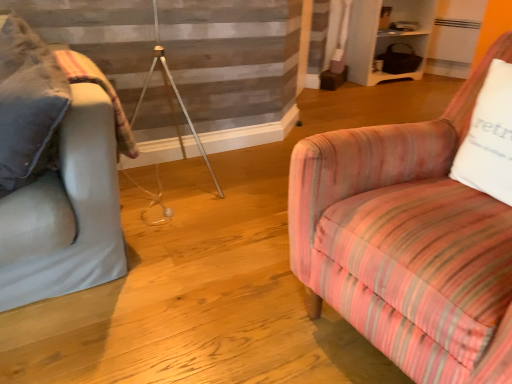
Question: From the image's perspective, is pink striped fabric chair at right above or below white cotton pillow at right?

Choices:
 (A) below
 (B) above

Answer: (A)

Question: From a real-world perspective, is pink striped fabric chair at right physically located above or below white cotton pillow at right?

Choices:
 (A) above
 (B) below

Answer: (B)

Question: Which object is positioned closest to the light gray fabric couch at left?

Choices:
 (A) white cotton pillow at right
 (B) plush beige blanket at left
 (C) pink striped fabric chair at right

Answer: (B)

Question: Considering the real-world distances, which object is closest to the white cotton pillow at right?

Choices:
 (A) light gray fabric couch at left
 (B) pink striped fabric chair at right
 (C) plush beige blanket at left

Answer: (B)